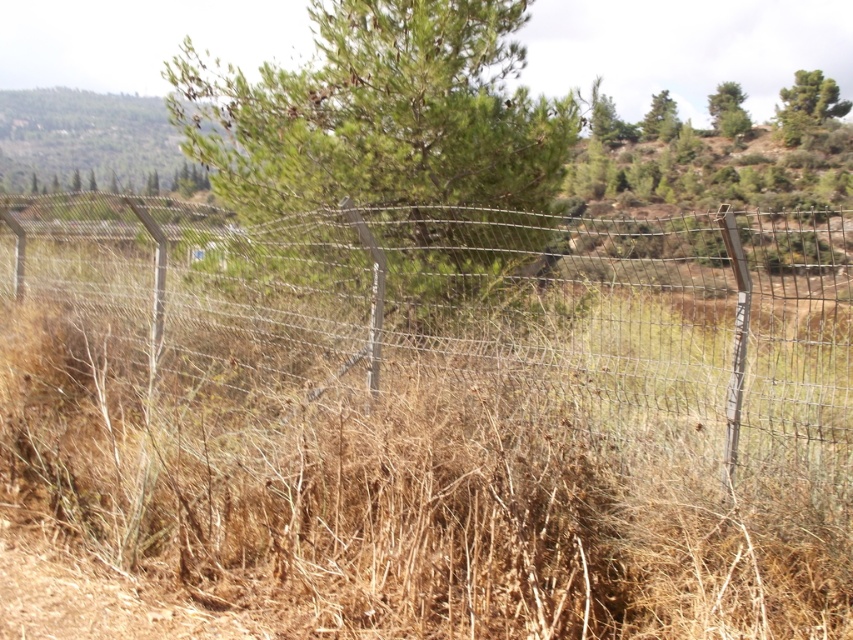
From the picture: Between green textured tree at upper right and green matte tree at upper right, which one is positioned higher?

Positioned higher is green matte tree at upper right.

Does point (830, 83) lie in front of point (653, 138)?

That is False.

Find the location of `green textured tree at upper right`. green textured tree at upper right is located at coordinates (807, 106).

Is green leafy tree at upper right in front of green matte tree at upper right?

That is True.

Who is taller, green leafy tree at upper right or green matte tree at upper right?

With more height is green leafy tree at upper right.

Which is in front, point (732, 109) or point (660, 125)?

Point (660, 125) is more forward.

The image size is (853, 640). Find the location of `green leafy tree at upper right`. green leafy tree at upper right is located at coordinates (728, 109).

At what (x,y) coordinates should I click in order to perform the action: click on green textured tree at upper right. Please return your answer as a coordinate pair (x, y). The width and height of the screenshot is (853, 640). Looking at the image, I should click on (807, 106).

Is the position of green textured tree at upper right more distant than that of green leafy tree at upper right?

No, green textured tree at upper right is in front of green leafy tree at upper right.

Measure the distance between green textured tree at upper right and camera.

The distance of green textured tree at upper right from camera is 52.77 meters.

At what (x,y) coordinates should I click in order to perform the action: click on green textured tree at upper right. Please return your answer as a coordinate pair (x, y). The width and height of the screenshot is (853, 640). Looking at the image, I should click on (807, 106).